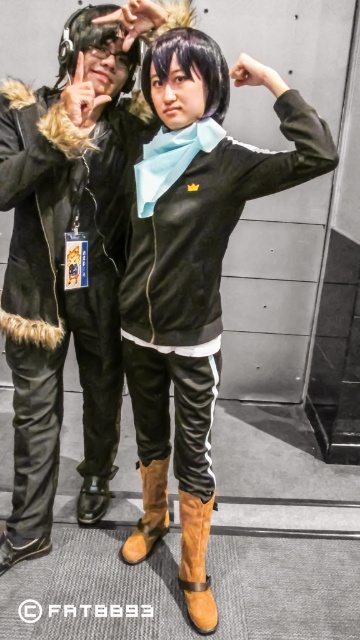
Between leather jacket at left and brown suede boot at lower center, which one appears on the left side from the viewer's perspective?

leather jacket at left

Which of these two, leather jacket at left or brown suede boot at lower center, stands shorter?

Standing shorter between the two is brown suede boot at lower center.

Which is in front, point (47, 115) or point (146, 481)?

Point (47, 115) is more forward.

This screenshot has height=640, width=360. Find the location of `leather jacket at left`. leather jacket at left is located at coordinates (66, 260).

Is suede boot at lower center to the right of brown suede boot at lower center from the viewer's perspective?

Yes, suede boot at lower center is to the right of brown suede boot at lower center.

Between point (199, 548) and point (145, 538), which one is positioned in front?

Point (199, 548) is more forward.

Who is more forward, (190, 522) or (140, 468)?

Point (190, 522)

In order to click on suede boot at lower center in this screenshot , I will do [x=195, y=561].

Can you confirm if leather jacket at left is bigger than suede boot at lower center?

Yes, leather jacket at left is bigger than suede boot at lower center.

Which is in front, point (23, 344) or point (208, 531)?

Point (23, 344)

Does point (24, 340) lie in front of point (205, 630)?

No.

Identify the location of leather jacket at left. (66, 260).